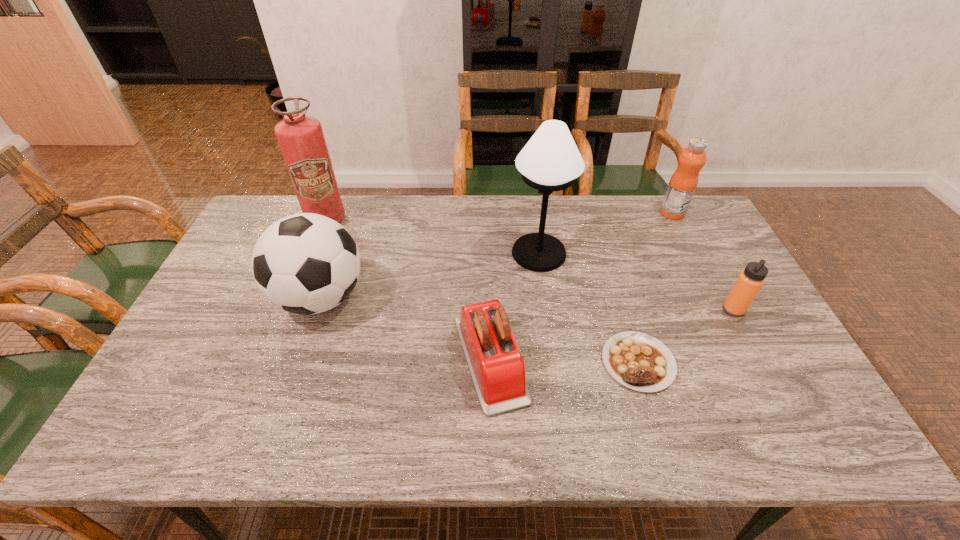
Locate an element on the screen. This screenshot has height=540, width=960. free spot between the table lamp and the fire extinguisher is located at coordinates (432, 237).

Locate an element on the screen. This screenshot has height=540, width=960. vacant area that lies between the table lamp and the toaster is located at coordinates (515, 306).

This screenshot has width=960, height=540. In order to click on vacant region between the table lamp and the thermos bottle in this screenshot , I will do `click(636, 281)`.

The width and height of the screenshot is (960, 540). I want to click on vacant region between the soccer ball and the thermos bottle, so click(527, 304).

You are a GUI agent. You are given a task and a screenshot of the screen. Output one action in this format:
    pyautogui.click(x=<x>, y=<y>)
    Task: Click on the vacant space that is in between the toaster and the steak
    Image resolution: width=960 pixels, height=540 pixels.
    Given the screenshot: What is the action you would take?
    click(x=564, y=361)

This screenshot has height=540, width=960. I want to click on empty space that is in between the table lamp and the fruit juice, so click(606, 233).

Identify which object is the closest to the soccer ball. Please provide its 2D coordinates. Your answer should be formatted as a tuple, i.e. [(x, y)], where the tuple contains the x and y coordinates of a point satisfying the conditions above.

[(300, 137)]

Select which object appears as the third closest to the fire extinguisher. Please provide its 2D coordinates. Your answer should be formatted as a tuple, i.e. [(x, y)], where the tuple contains the x and y coordinates of a point satisfying the conditions above.

[(550, 161)]

The width and height of the screenshot is (960, 540). In order to click on free space that satisfies the following two spatial constraints: 1. on the label side of the fire extinguisher; 2. on the right side of the shortest object in this screenshot , I will do pos(269,362).